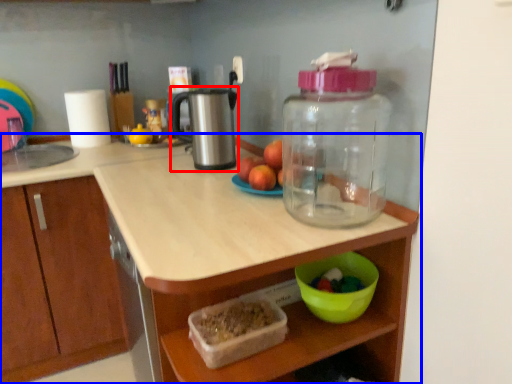
Question: Which object is closer to the camera taking this photo, appliance (highlighted by a red box) or countertop (highlighted by a blue box)?

Choices:
 (A) appliance
 (B) countertop

Answer: (A)